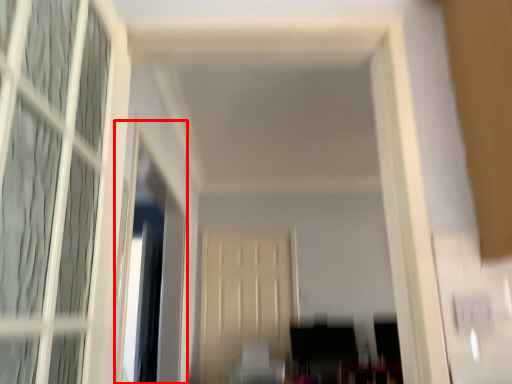
Question: From the image's perspective, considering the relative positions of window screen (annotated by the red box) and screen door in the image provided, where is window screen (annotated by the red box) located with respect to the staircase?

Choices:
 (A) above
 (B) below

Answer: (A)